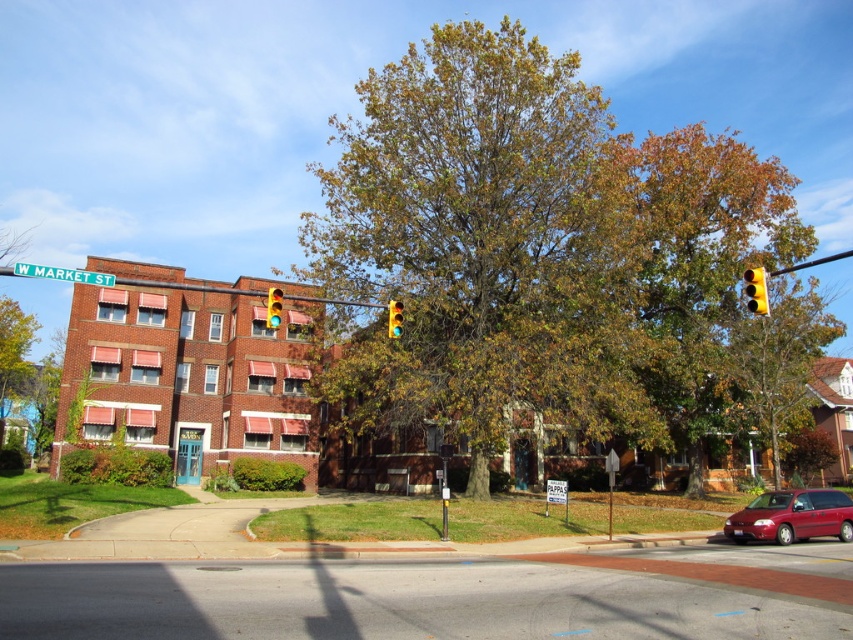
Does brown textured tree at right appear over yellow plastic traffic light at upper right?

Yes, brown textured tree at right is above yellow plastic traffic light at upper right.

Is brown textured tree at right smaller than yellow plastic traffic light at upper right?

Actually, brown textured tree at right might be larger than yellow plastic traffic light at upper right.

Image resolution: width=853 pixels, height=640 pixels. Identify the location of brown textured tree at right. (780, 358).

This screenshot has width=853, height=640. What are the coordinates of `brown textured tree at right` in the screenshot? It's located at pos(780,358).

Who is positioned more to the left, green metallic street sign at upper left or green glass traffic light at center?

Positioned to the left is green metallic street sign at upper left.

Can you confirm if green metallic street sign at upper left is thinner than green glass traffic light at center?

No, green metallic street sign at upper left is not thinner than green glass traffic light at center.

Who is more forward, (111, 285) or (276, 289)?

Point (111, 285) is in front.

Find the location of a particular element. This screenshot has height=640, width=853. green metallic street sign at upper left is located at coordinates (64, 273).

Which is more to the right, green metallic street sign at upper left or yellow glass traffic light at upper center?

yellow glass traffic light at upper center is more to the right.

Which is behind, point (19, 268) or point (387, 323)?

The point (387, 323) is behind.

Image resolution: width=853 pixels, height=640 pixels. I want to click on green metallic street sign at upper left, so click(64, 273).

Find the location of a particular element. The height and width of the screenshot is (640, 853). green metallic street sign at upper left is located at coordinates click(x=64, y=273).